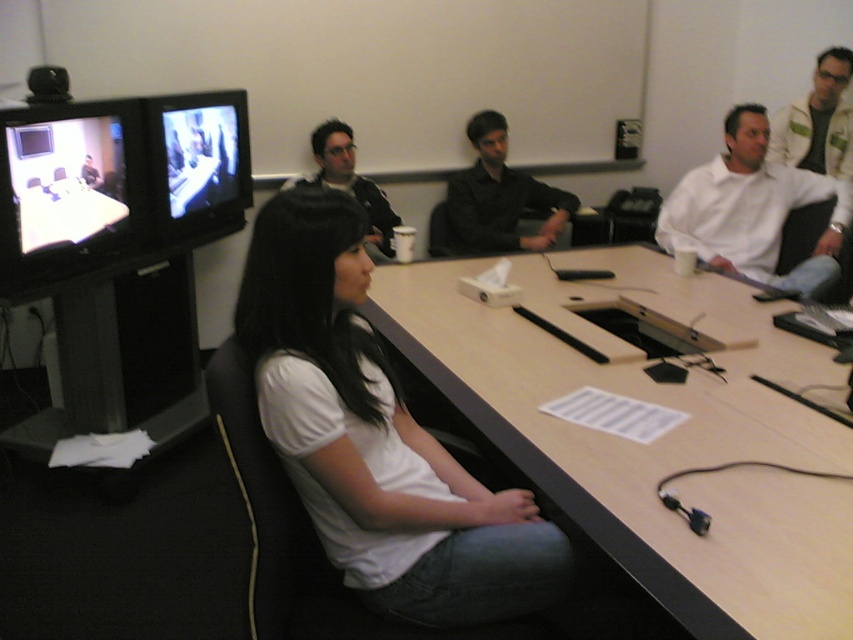
Question: Which point is closer to the camera?

Choices:
 (A) (494, 157)
 (B) (804, 164)
 (C) (364, 180)
 (D) (459, 337)

Answer: (D)

Question: Can you confirm if light brown wood table at center is smaller than white shirt at upper right?

Choices:
 (A) no
 (B) yes

Answer: (A)

Question: Does light brown wood table at center have a smaller size compared to dark gray shirt at center?

Choices:
 (A) no
 (B) yes

Answer: (A)

Question: Which point is farther to the camera?

Choices:
 (A) (378, 257)
 (B) (816, 124)
 (C) (651, 515)

Answer: (B)

Question: Is white matte shirt at center smaller than white shirt at upper right?

Choices:
 (A) yes
 (B) no

Answer: (A)

Question: Which is nearer to the light brown wood table at center?

Choices:
 (A) dark gray shirt at center
 (B) matte black jacket at center

Answer: (A)